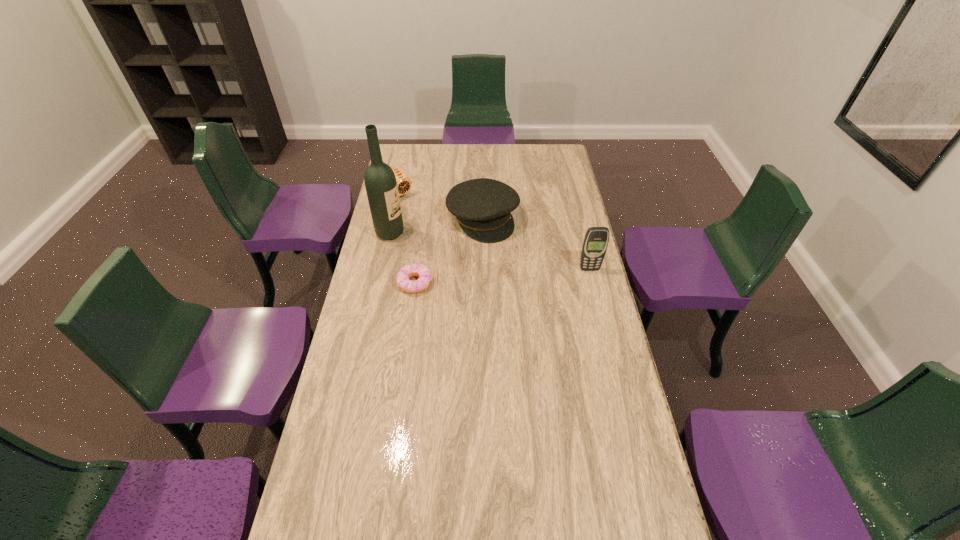
Where is `free spot between the wine bottle and the beret`? This screenshot has width=960, height=540. free spot between the wine bottle and the beret is located at coordinates (437, 226).

Identify the location of free space between the watch and the doughnut. (407, 238).

Identify the location of object that is the fourth closest to the doughnut. (596, 239).

Select which object is the fourth closest to the shortest object. Please provide its 2D coordinates. Your answer should be formatted as a tuple, i.e. [(x, y)], where the tuple contains the x and y coordinates of a point satisfying the conditions above.

[(596, 239)]

Locate an element on the screen. The width and height of the screenshot is (960, 540). vacant point that satisfies the following two spatial constraints: 1. on the front side of the fourth object from left to right; 2. on the right side of the watch is located at coordinates (394, 219).